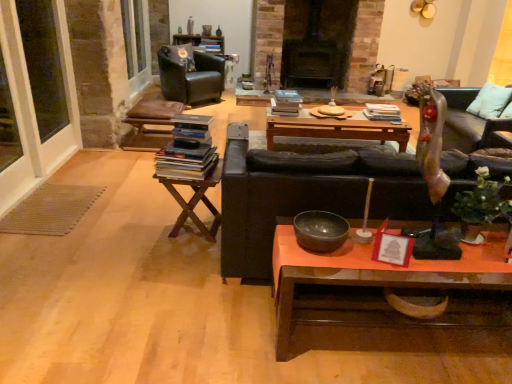
The image size is (512, 384). Identify the location of free space that is to the left of wooden polished coffee table at lower center, the 1th coffee table ordered from the bottom. tap(206, 321).